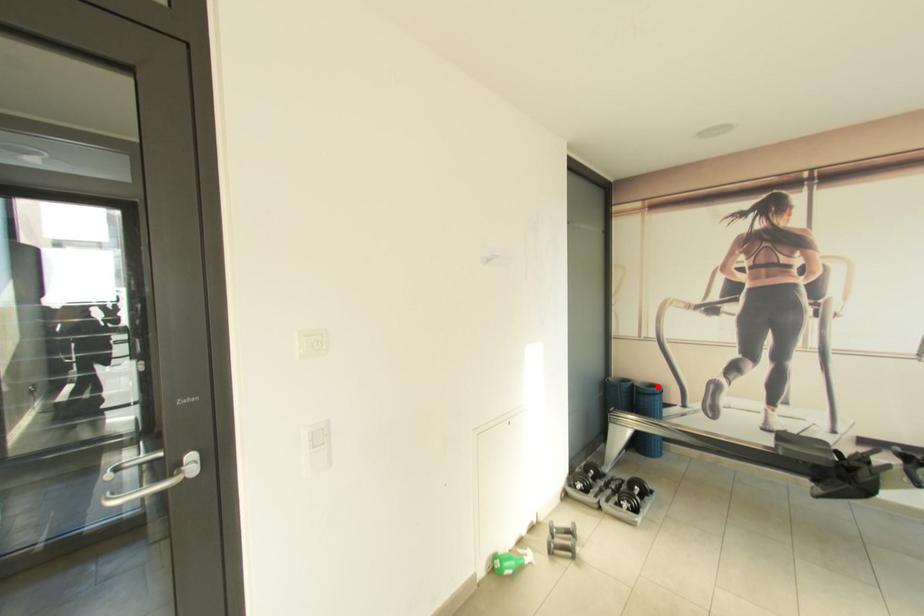
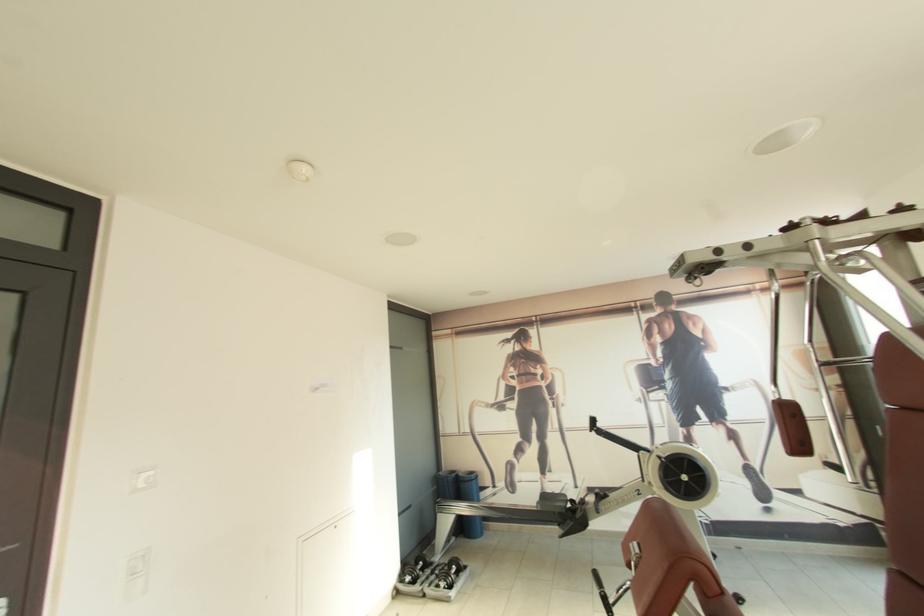
In the second image, find the point that corresponds to the highlighted location in the first image.

(476, 475)